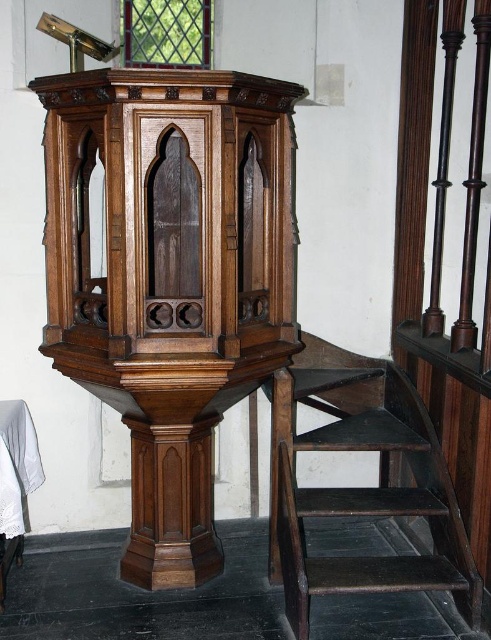
Find the location of a particular element. This screenshot has height=640, width=491. polished wood pulpit at center is located at coordinates (170, 276).

Where is `polished wood pulpit at center`? The width and height of the screenshot is (491, 640). polished wood pulpit at center is located at coordinates (170, 276).

Who is taller, polished wood pulpit at center or dark brown wooden stairs at lower right?

polished wood pulpit at center

Locate an element on the screen. The width and height of the screenshot is (491, 640). polished wood pulpit at center is located at coordinates (170, 276).

Can you confirm if dark brown wooden stairs at lower right is positioned to the right of white cloth at lower left?

Indeed, dark brown wooden stairs at lower right is positioned on the right side of white cloth at lower left.

Can you confirm if dark brown wooden stairs at lower right is positioned to the left of white cloth at lower left?

No, dark brown wooden stairs at lower right is not to the left of white cloth at lower left.

Between point (461, 612) and point (17, 556), which one is positioned in front?

Positioned in front is point (461, 612).

Where is `dark brown wooden stairs at lower right`? The width and height of the screenshot is (491, 640). dark brown wooden stairs at lower right is located at coordinates [x=377, y=512].